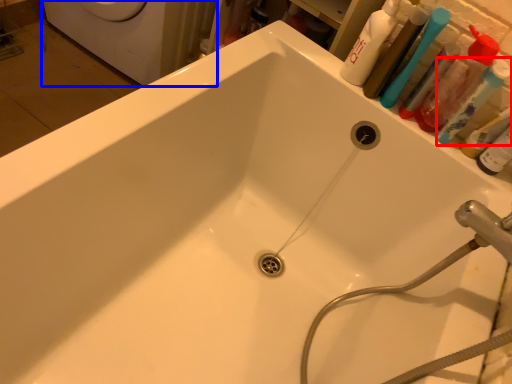
Question: Among these objects, which one is nearest to the camera, toothbrush (highlighted by a red box) or washing machine (highlighted by a blue box)?

Choices:
 (A) toothbrush
 (B) washing machine

Answer: (A)